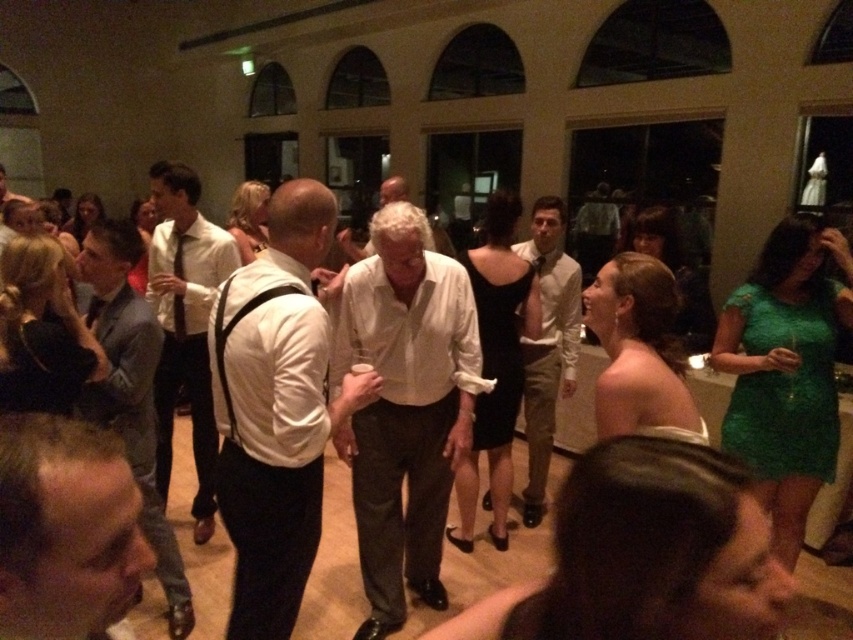
You are standing in the room and want to place a small decoration exactly at point (405, 406). Based on the scene description, where will this decoration be placed?

The point (405, 406) is on the white cotton shirt at center, so placing the decoration there would place it on the white cotton shirt at center.

You are a photographer at the event and want to capture both the white matte shirt at center and the light gray suit at center in a single frame. Which of the two should you focus on first to ensure proper framing?

The white matte shirt at center is not as tall as the light gray suit at center, so you should focus on the light gray suit at center first to ensure proper framing.